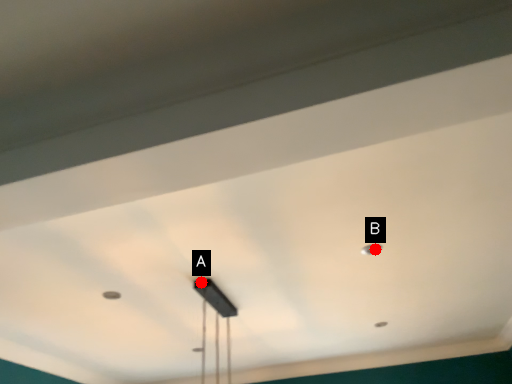
Question: Two points are circled on the image, labeled by A and B beside each circle. Which point is farther to the camera?

Choices:
 (A) A is further
 (B) B is further

Answer: (A)